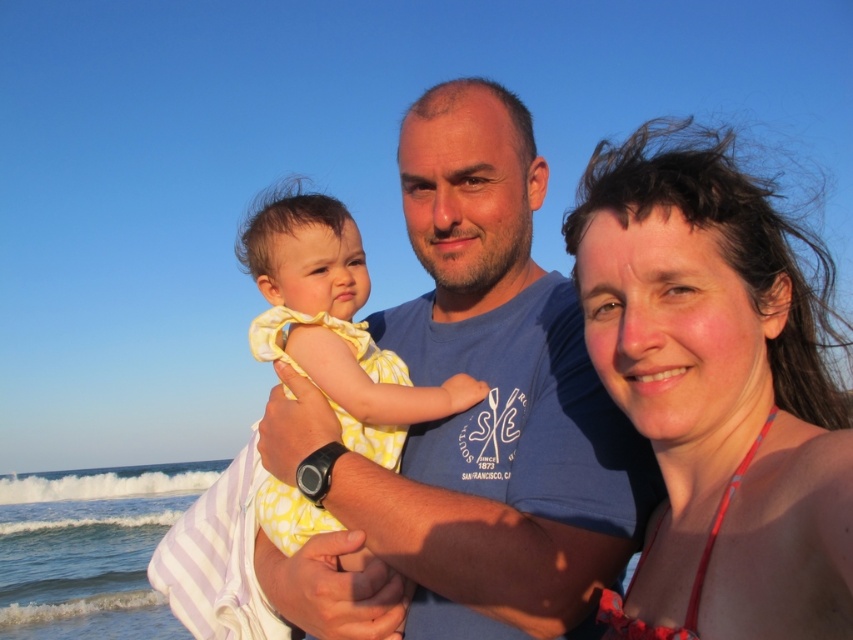
What is located at the coordinates point (480, 417)?

The blue cotton shirt at center is located at point (480, 417).

You are a photographer trying to capture a family photo at the beach. You notice the blue cotton shirt at center and the yellow dotted dress at center. Which clothing item appears narrower in the scene?

The blue cotton shirt at center has a lesser width compared to the yellow dotted dress at center, so the blue cotton shirt at center appears narrower.

What are the coordinates of the blue cotton shirt at center?

The coordinates of the blue cotton shirt at center are at point (480, 417).